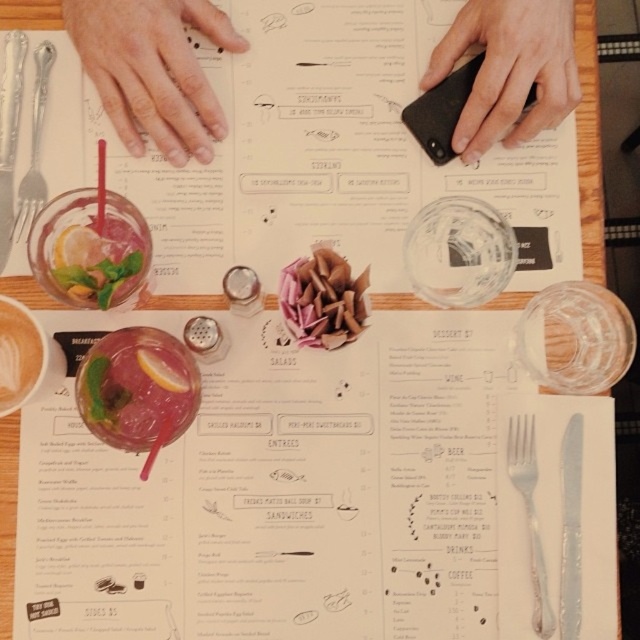
Question: Does pink translucent glass at upper left have a smaller size compared to pink paper flower at center?

Choices:
 (A) no
 (B) yes

Answer: (A)

Question: From the image, what is the correct spatial relationship of black matte phone at upper right in relation to silver metallic fork at center?

Choices:
 (A) right
 (B) left

Answer: (B)

Question: Which object is positioned closest to the black matte phone at upper right?

Choices:
 (A) smooth white coffee cup at lower left
 (B) silver metallic fork at center
 (C) smooth skin hands at center

Answer: (C)

Question: Considering the real-world distances, which object is farthest from the silver metallic fork at center?

Choices:
 (A) pink translucent glass at upper left
 (B) silver metallic fork at left
 (C) black matte phone at upper right

Answer: (B)

Question: Based on their relative distances, which object is nearer to the pink translucent glass at upper left?

Choices:
 (A) silver metallic fork at center
 (B) silver metallic fork at left
 (C) black matte phone at upper right

Answer: (B)

Question: Does smooth skin hands at center have a greater width compared to matte skin hand at upper center?

Choices:
 (A) no
 (B) yes

Answer: (B)